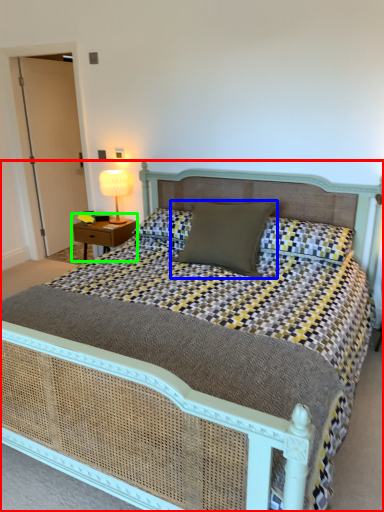
Question: Based on their relative distances, which object is nearer to bed (highlighted by a red box)? Choose from pillow (highlighted by a blue box) and nightstand (highlighted by a green box).

Choices:
 (A) pillow
 (B) nightstand

Answer: (A)